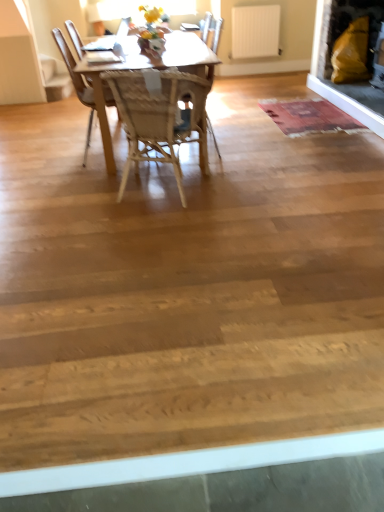
This screenshot has width=384, height=512. Identify the location of vacant region in front of woven wood chair at center, the 2th chair when ordered from back to front. (170, 220).